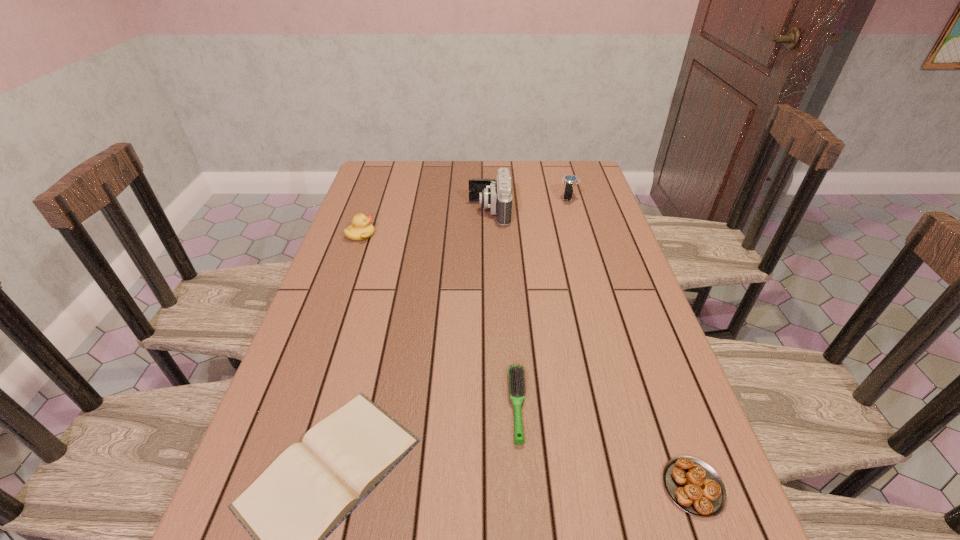
You are a GUI agent. You are given a task and a screenshot of the screen. Output one action in this format:
    pyautogui.click(x=<x>, y=<y>)
    Task: Click on the vacant space at the far left corner of the desktop
    
    Given the screenshot: What is the action you would take?
    pyautogui.click(x=410, y=168)

The width and height of the screenshot is (960, 540). I want to click on vacant area that lies between the watch and the hairbrush, so click(x=543, y=301).

Where is `free space between the duckling and the watch`? The width and height of the screenshot is (960, 540). free space between the duckling and the watch is located at coordinates (465, 217).

Find the location of a particular element. This screenshot has width=960, height=540. free space between the watch and the pastry is located at coordinates (631, 342).

I want to click on empty space that is in between the watch and the duckling, so click(465, 217).

In order to click on vacant point located between the duckling and the tallest object in this screenshot , I will do `click(425, 223)`.

Find the location of `free space that is in between the hairbrush and the pastry`. free space that is in between the hairbrush and the pastry is located at coordinates (606, 446).

Where is `object that is the third closest to the hairbrush`? The image size is (960, 540). object that is the third closest to the hairbrush is located at coordinates (496, 195).

Select which object is the third closest to the camera. Please provide its 2D coordinates. Your answer should be formatted as a tuple, i.e. [(x, y)], where the tuple contains the x and y coordinates of a point satisfying the conditions above.

[(516, 374)]

At what (x,y) coordinates should I click in order to perform the action: click on vacant position in the image that satisfies the following two spatial constraints: 1. on the front-facing side of the pastry; 2. on the left side of the duckling. Please return your answer as a coordinate pair (x, y). The width and height of the screenshot is (960, 540). Looking at the image, I should click on (274, 487).